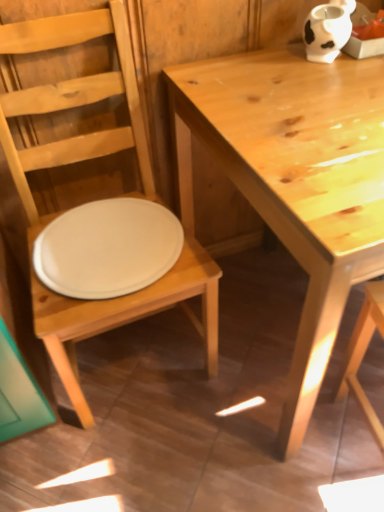
Where is `empty space that is ontop of white matte plate at center (from a real-world perspective)`? Image resolution: width=384 pixels, height=512 pixels. empty space that is ontop of white matte plate at center (from a real-world perspective) is located at coordinates (107, 234).